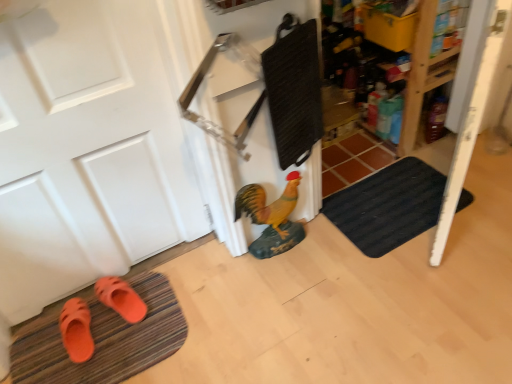
Locate an element on the screen. This screenshot has width=512, height=384. free space in front of shiny yellow chicken at center is located at coordinates (283, 284).